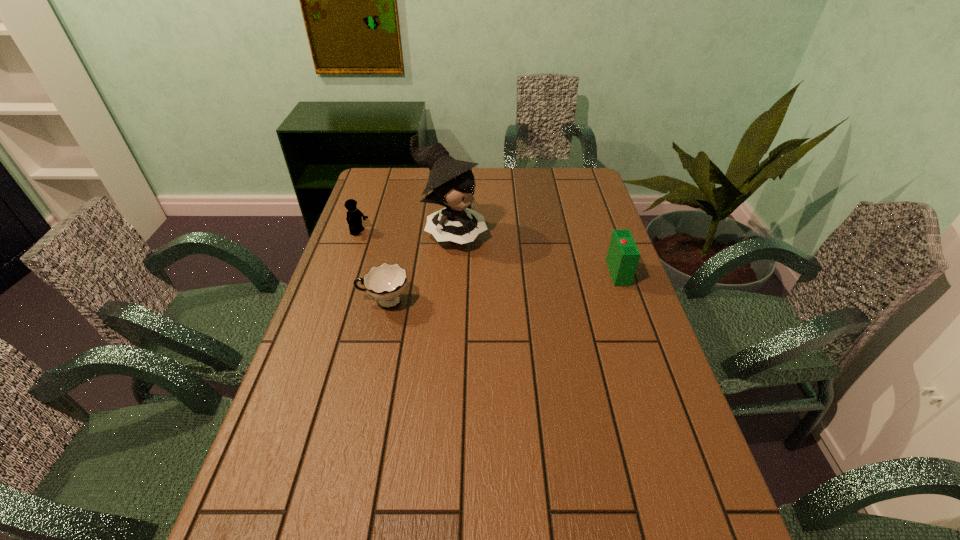
The width and height of the screenshot is (960, 540). Find the location of `vacant space located on the front-facing side of the Lego`. vacant space located on the front-facing side of the Lego is located at coordinates (399, 249).

Identify the location of vacant space situated at the face of the tallest object. (517, 269).

Identify the location of vacant region located at the face of the tallest object. This screenshot has height=540, width=960. (540, 282).

Identify the location of free space located 0.180m at the face of the tallest object. This screenshot has height=540, width=960. (522, 272).

Identify the location of cup that is at the left edge. The height and width of the screenshot is (540, 960). (386, 282).

Where is `Lego that is at the left edge`? The width and height of the screenshot is (960, 540). Lego that is at the left edge is located at coordinates click(354, 216).

Identify the location of object at the right edge. (622, 259).

At what (x,y) coordinates should I click in order to perform the action: click on free region at the far edge. Please return your answer as a coordinate pair (x, y). The height and width of the screenshot is (540, 960). Looking at the image, I should click on (523, 168).

Locate an element on the screen. The image size is (960, 540). free spot at the left edge of the desktop is located at coordinates (347, 240).

You are a GUI agent. You are given a task and a screenshot of the screen. Output one action in this format:
    pyautogui.click(x=<x>, y=<y>)
    Task: Click on the vacant space at the right edge of the desktop
    This screenshot has height=540, width=960.
    Given the screenshot: What is the action you would take?
    (596, 228)